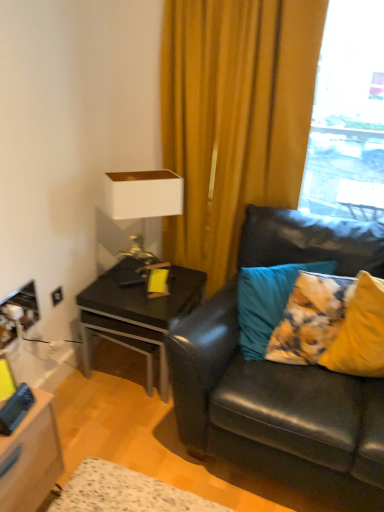
The width and height of the screenshot is (384, 512). Find the location of `free spot in front of white matte table lamp at upper left`. free spot in front of white matte table lamp at upper left is located at coordinates coord(147,301).